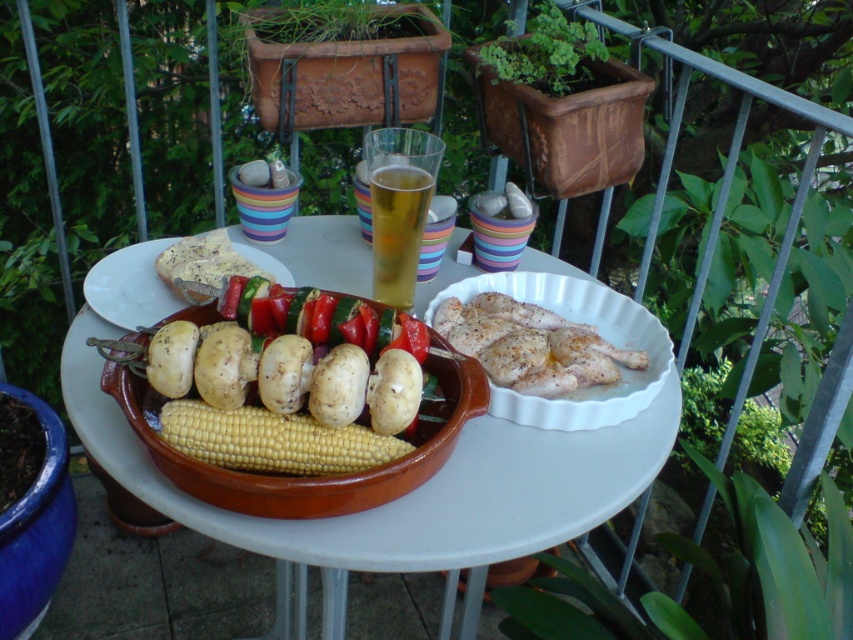
Consider the image. Is golden brown chicken at center to the left of white paper plate at center from the viewer's perspective?

No, golden brown chicken at center is not to the left of white paper plate at center.

The image size is (853, 640). Describe the element at coordinates (531, 346) in the screenshot. I see `golden brown chicken at center` at that location.

The image size is (853, 640). I want to click on golden brown chicken at center, so click(x=531, y=346).

Is smooth red pepper at center further to camera compared to smooth white potatoes at center?

Yes, smooth red pepper at center is behind smooth white potatoes at center.

Where is `smooth red pepper at center`? The width and height of the screenshot is (853, 640). smooth red pepper at center is located at coordinates (318, 317).

Where is `smooth red pepper at center`? Image resolution: width=853 pixels, height=640 pixels. smooth red pepper at center is located at coordinates (318, 317).

Between golden brown chicken at center and smooth white potatoes at center, which one appears on the right side from the viewer's perspective?

golden brown chicken at center is more to the right.

Is golden brown chicken at center in front of smooth white potatoes at center?

No, it is not.

Between point (473, 349) and point (351, 413), which one is positioned behind?

The point (473, 349) is more distant.

Where is `golden brown chicken at center`? The height and width of the screenshot is (640, 853). golden brown chicken at center is located at coordinates (531, 346).